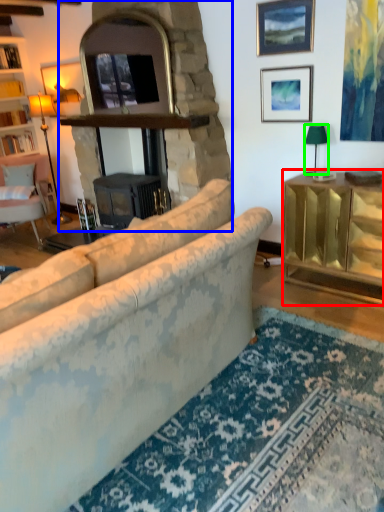
Question: Which is farther away from cabinetry (highlighted by a red box)? fireplace (highlighted by a blue box) or lamp (highlighted by a green box)?

Choices:
 (A) fireplace
 (B) lamp

Answer: (A)